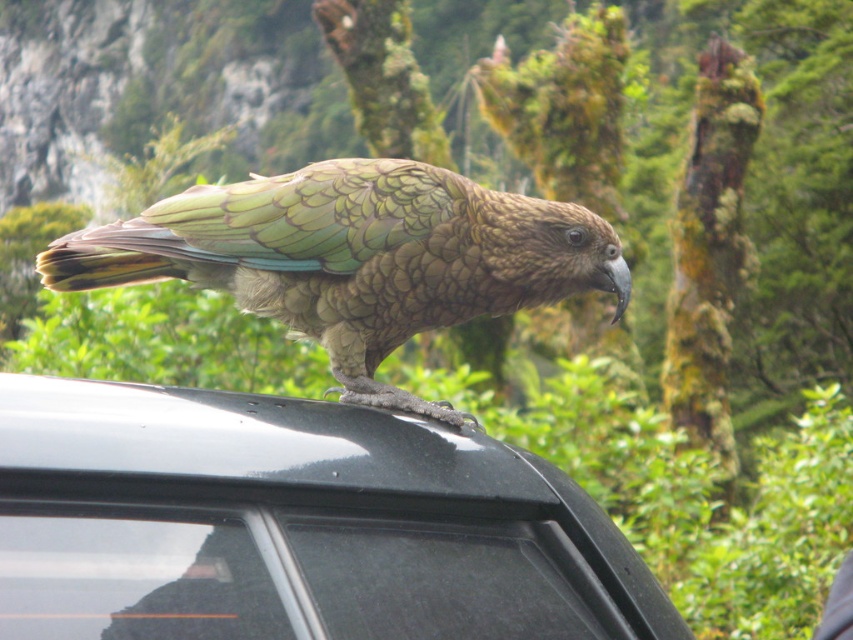
Is point (503, 467) positioned before point (299, 266)?

That is True.

Does glossy black car at top have a greater height compared to green scaly parrot at center?

In fact, glossy black car at top may be shorter than green scaly parrot at center.

Locate an element on the screen. This screenshot has width=853, height=640. glossy black car at top is located at coordinates (341, 508).